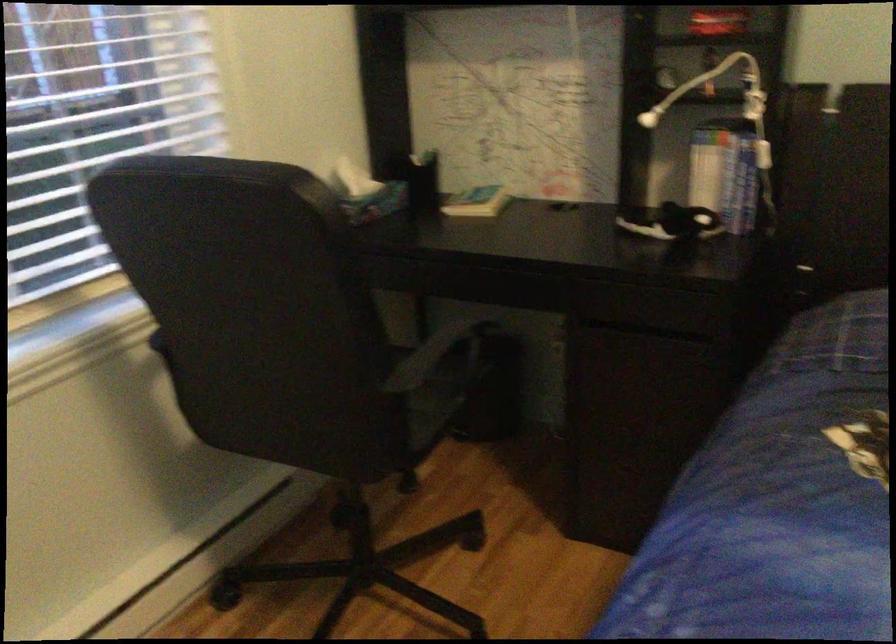
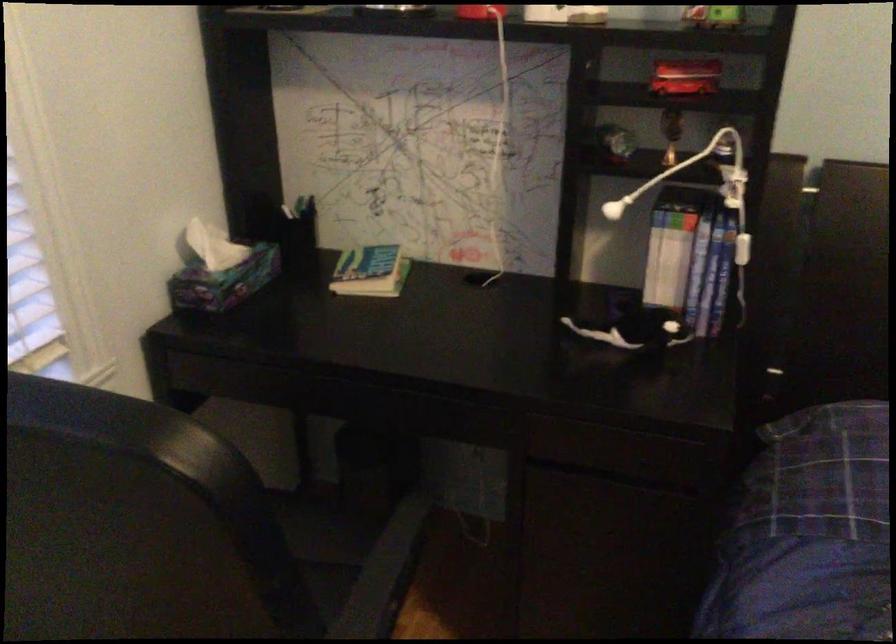
The point at [420,156] is marked in the first image. Where is the corresponding point in the second image?

(295, 211)